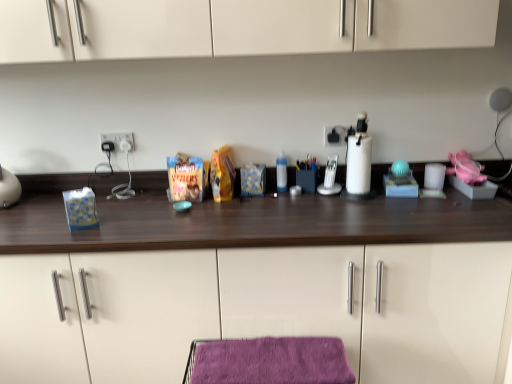
Question: From a real-world perspective, is silver metallic phone at center beneath black plastic electric outlet at upper center, the 1th electric outlet in the right-to-left sequence?

Choices:
 (A) no
 (B) yes

Answer: (B)

Question: From the image's perspective, is silver metallic phone at center under black plastic electric outlet at upper center, which is the second electric outlet in left-to-right order?

Choices:
 (A) no
 (B) yes

Answer: (B)

Question: Does silver metallic phone at center appear on the right side of black plastic electric outlet at upper center, the 1th electric outlet in the right-to-left sequence?

Choices:
 (A) no
 (B) yes

Answer: (A)

Question: Would you say silver metallic phone at center is a long distance from black plastic electric outlet at upper center, the 1th electric outlet in the right-to-left sequence?

Choices:
 (A) no
 (B) yes

Answer: (A)

Question: From the image's perspective, is silver metallic phone at center located above black plastic electric outlet at upper center, which is the second electric outlet in left-to-right order?

Choices:
 (A) no
 (B) yes

Answer: (A)

Question: Visually, is wooden countertop at center positioned to the left or to the right of purple velvet towel at lower center?

Choices:
 (A) right
 (B) left

Answer: (B)

Question: In terms of height, does wooden countertop at center look taller or shorter compared to purple velvet towel at lower center?

Choices:
 (A) short
 (B) tall

Answer: (B)

Question: Considering the positions of point (170, 271) and point (310, 352), is point (170, 271) closer or farther from the camera than point (310, 352)?

Choices:
 (A) closer
 (B) farther

Answer: (B)

Question: Is wooden countertop at center in front of or behind purple velvet towel at lower center in the image?

Choices:
 (A) front
 (B) behind

Answer: (B)

Question: Is black plastic electric outlet at upper center, the 1th electric outlet in the right-to-left sequence, inside or outside of transparent plastic bottle at center?

Choices:
 (A) outside
 (B) inside

Answer: (A)

Question: Is point (324, 137) closer or farther from the camera than point (281, 165)?

Choices:
 (A) farther
 (B) closer

Answer: (A)

Question: In terms of size, does black plastic electric outlet at upper center, the 1th electric outlet in the right-to-left sequence, appear bigger or smaller than transparent plastic bottle at center?

Choices:
 (A) small
 (B) big

Answer: (A)

Question: From a real-world perspective, is black plastic electric outlet at upper center, the 1th electric outlet in the right-to-left sequence, physically located above or below transparent plastic bottle at center?

Choices:
 (A) above
 (B) below

Answer: (A)

Question: Looking at the image, does white plastic electric outlet at center, the 2th electric outlet positioned from the right, seem bigger or smaller compared to transparent plastic bottle at center?

Choices:
 (A) small
 (B) big

Answer: (A)

Question: From a real-world perspective, is white plastic electric outlet at center, the 1th electric outlet when ordered from left to right, positioned above or below transparent plastic bottle at center?

Choices:
 (A) above
 (B) below

Answer: (A)